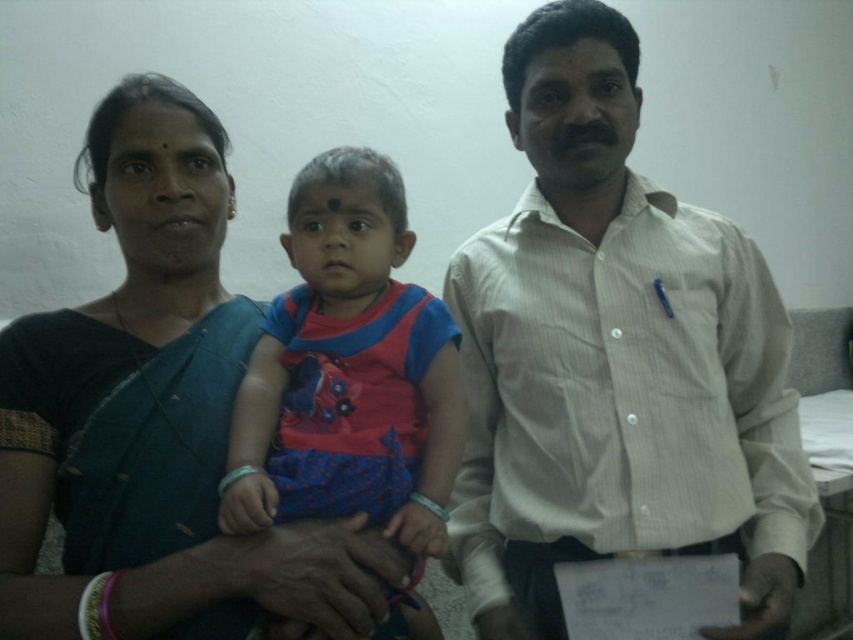
Question: Which object appears closest to the camera in this image?

Choices:
 (A) dark blue sari at center
 (B) white striped shirt at center
 (C) matte pink fabric dress at center

Answer: (A)

Question: Can you confirm if white striped shirt at center is smaller than dark blue sari at center?

Choices:
 (A) no
 (B) yes

Answer: (B)

Question: Is white striped shirt at center in front of dark blue sari at center?

Choices:
 (A) yes
 (B) no

Answer: (B)

Question: Which of these objects is positioned closest to the dark blue sari at center?

Choices:
 (A) white striped shirt at center
 (B) matte pink fabric dress at center

Answer: (B)

Question: Among these objects, which one is farthest from the camera?

Choices:
 (A) matte pink fabric dress at center
 (B) dark blue sari at center
 (C) white striped shirt at center

Answer: (C)

Question: Can you confirm if dark blue sari at center is positioned to the right of matte pink fabric dress at center?

Choices:
 (A) no
 (B) yes

Answer: (A)